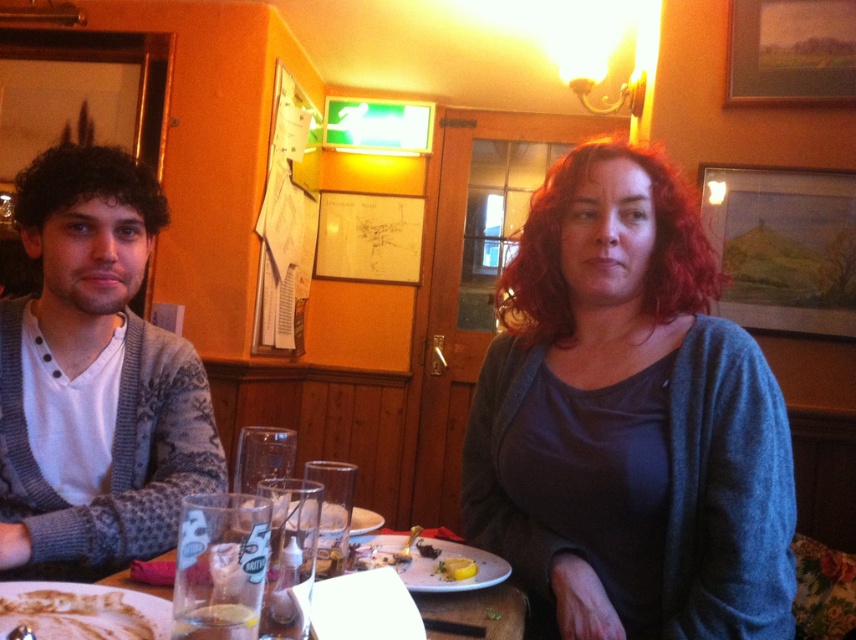
Who is positioned more to the left, dark gray sweater at center or yellow matte lemon at lower center?

Positioned to the left is yellow matte lemon at lower center.

Is point (589, 531) closer to camera compared to point (443, 563)?

No, it is behind (443, 563).

What do you see at coordinates (629, 419) in the screenshot? I see `dark gray sweater at center` at bounding box center [629, 419].

The width and height of the screenshot is (856, 640). In order to click on dark gray sweater at center in this screenshot , I will do click(x=629, y=419).

The height and width of the screenshot is (640, 856). What do you see at coordinates (629, 419) in the screenshot? I see `dark gray sweater at center` at bounding box center [629, 419].

Is the position of dark gray sweater at center more distant than that of white creamy cake at lower left?

That is True.

Who is more distant from viewer, [603,451] or [88,598]?

The point [603,451] is more distant.

Where is `dark gray sweater at center`? This screenshot has height=640, width=856. dark gray sweater at center is located at coordinates (629, 419).

Can you confirm if white creamy cake at lower left is positioned above yellow matte lemon at lower center?

Yes.

Does white creamy cake at lower left have a greater width compared to yellow matte lemon at lower center?

Yes.

This screenshot has height=640, width=856. What do you see at coordinates (76, 616) in the screenshot?
I see `white creamy cake at lower left` at bounding box center [76, 616].

You are a GUI agent. You are given a task and a screenshot of the screen. Output one action in this format:
    pyautogui.click(x=<x>, y=<y>)
    Task: Click on the white creamy cake at lower left
    
    Given the screenshot: What is the action you would take?
    pyautogui.click(x=76, y=616)